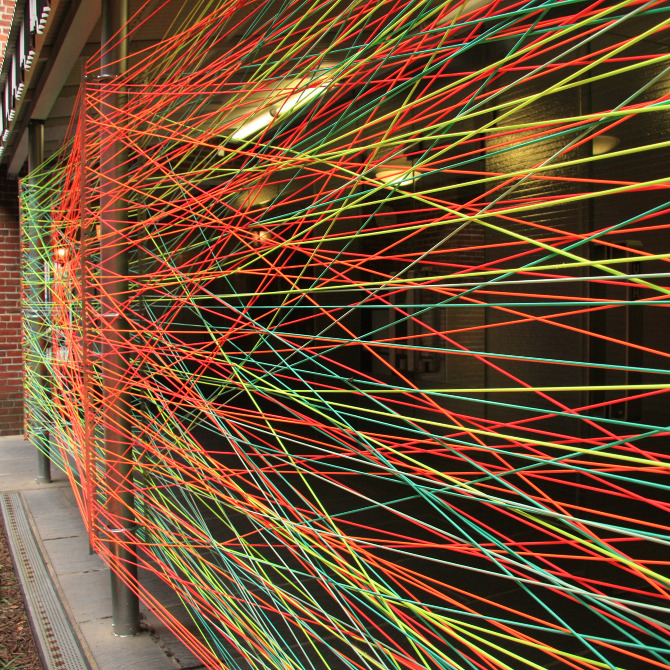
The width and height of the screenshot is (670, 670). I want to click on brick wall, so click(9, 220), click(13, 271), click(13, 346), click(9, 401), click(9, 322).